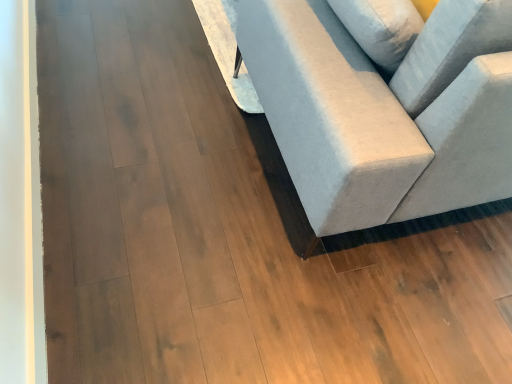
Find the location of a particular element. The height and width of the screenshot is (384, 512). free location in front of light gray fabric couch at right is located at coordinates (275, 273).